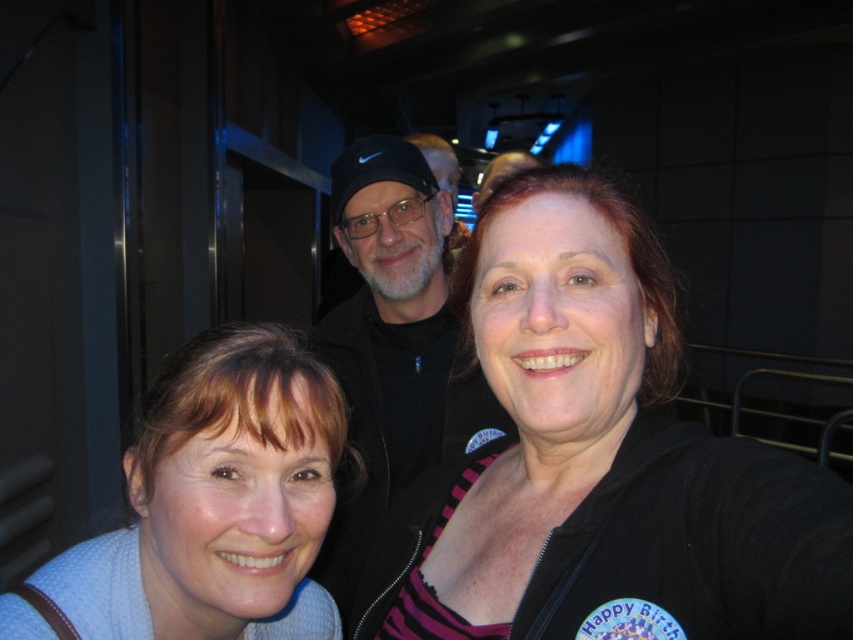
Can you confirm if blue knit sweater at lower left is positioned to the right of black fabric at center?

Incorrect, blue knit sweater at lower left is not on the right side of black fabric at center.

Which is in front, point (268, 454) or point (386, 172)?

Point (268, 454) is in front.

You are a GUI agent. You are given a task and a screenshot of the screen. Output one action in this format:
    pyautogui.click(x=<x>, y=<y>)
    Task: Click on the blue knit sweater at lower left
    Image resolution: width=853 pixels, height=640 pixels.
    Given the screenshot: What is the action you would take?
    pyautogui.click(x=218, y=500)

Is black matte jacket at center shorter than blue knit sweater at lower left?

Incorrect, black matte jacket at center's height does not fall short of blue knit sweater at lower left's.

Between point (625, 276) and point (200, 605), which one is positioned in front?

Point (200, 605)

Image resolution: width=853 pixels, height=640 pixels. Describe the element at coordinates (601, 461) in the screenshot. I see `black matte jacket at center` at that location.

Where is `black matte jacket at center`? This screenshot has height=640, width=853. black matte jacket at center is located at coordinates (601, 461).

Which of these two, black matte jacket at center or black fabric at center, stands taller?

With more height is black fabric at center.

From the picture: Who is positioned more to the left, black matte jacket at center or black fabric at center?

black fabric at center is more to the left.

What do you see at coordinates (601, 461) in the screenshot? I see `black matte jacket at center` at bounding box center [601, 461].

Image resolution: width=853 pixels, height=640 pixels. What are the coordinates of `black matte jacket at center` in the screenshot? It's located at (601, 461).